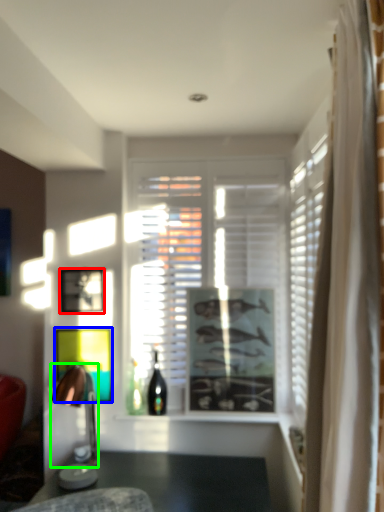
Question: Which object is the closest to the picture frame (highlighted by a red box)? Choose among these: picture frame (highlighted by a blue box) or lamp (highlighted by a green box).

Choices:
 (A) picture frame
 (B) lamp

Answer: (A)